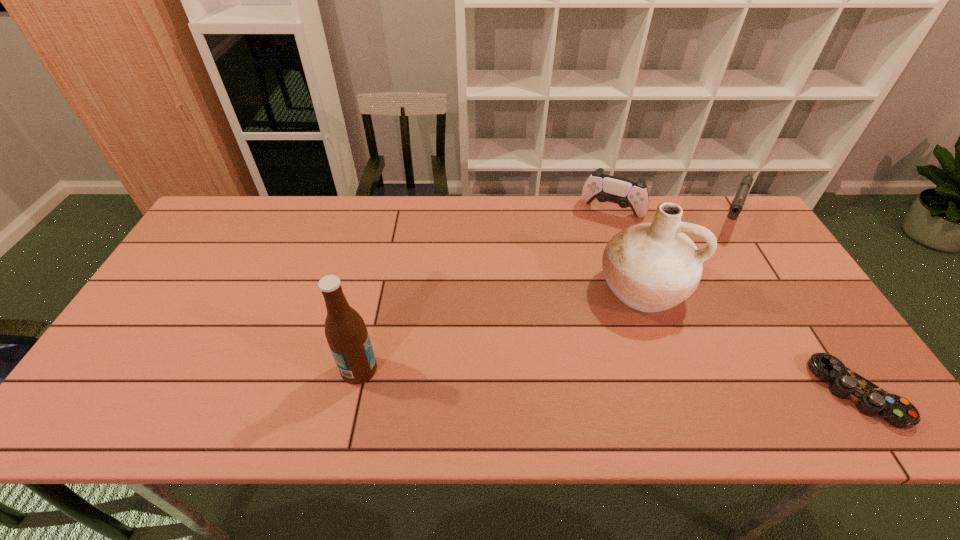
Identify the location of free space located 0.130m to pour from the handle of the pottery. (619, 360).

At what (x,y) coordinates should I click in order to perform the action: click on free space located to pour from the handle of the pottery. Please return your answer as a coordinate pair (x, y). The image size is (960, 540). Looking at the image, I should click on (618, 363).

Where is `free space located in the direction the gun is aimed`? free space located in the direction the gun is aimed is located at coordinates (704, 295).

At what (x,y) coordinates should I click in order to perform the action: click on vacant space located in the direction the gun is aimed. Please return your answer as a coordinate pair (x, y). The height and width of the screenshot is (540, 960). Looking at the image, I should click on (708, 284).

Image resolution: width=960 pixels, height=540 pixels. Identify the location of free space located 0.220m in the direction the gun is aimed. (710, 280).

Image resolution: width=960 pixels, height=540 pixels. I want to click on vacant space located on the front-facing side of the farther control, so click(564, 311).

The image size is (960, 540). In order to click on free location located on the front-facing side of the farther control in this screenshot , I will do (597, 237).

Locate an element on the screen. vacant position located 0.390m on the front-facing side of the farther control is located at coordinates (565, 308).

Where is `gun positioned at the far edge`? The height and width of the screenshot is (540, 960). gun positioned at the far edge is located at coordinates (737, 204).

Identify the location of control present at the far edge. (626, 193).